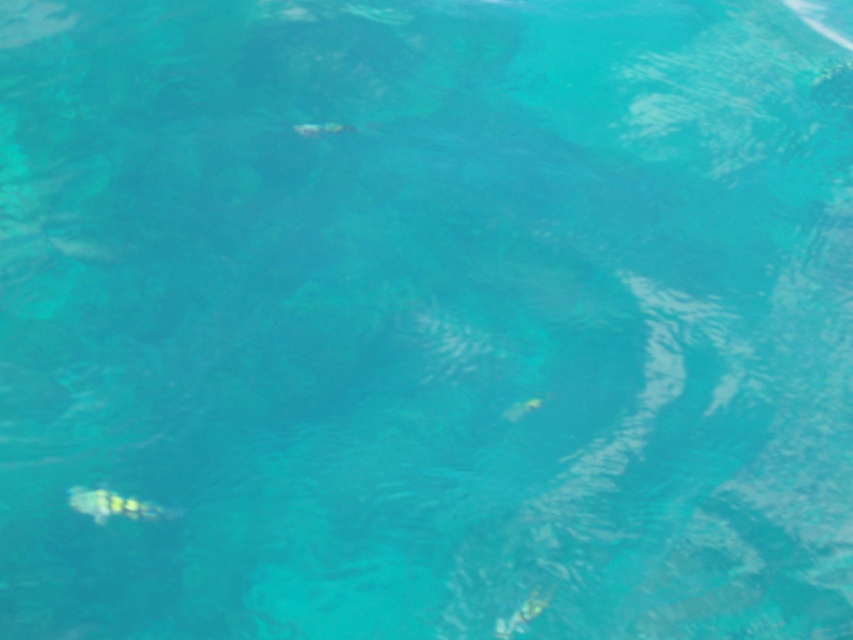
Locate an element on the screen. The height and width of the screenshot is (640, 853). translucent yellow fish at bottom left is located at coordinates (113, 506).

Is translucent yellow fish at bottom left positioned before translucent green fish at center?

Yes.

Is point (155, 506) in front of point (338, 131)?

Yes, it is.

Find the location of a particular element. translucent yellow fish at bottom left is located at coordinates (113, 506).